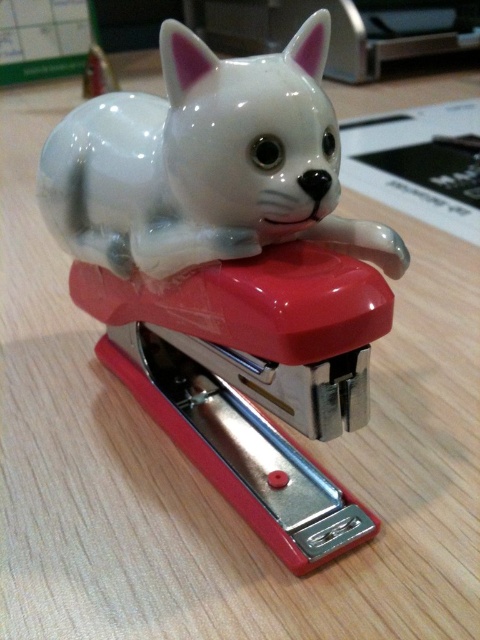
Question: Is red glossy stapler at center above white glossy cat at center?

Choices:
 (A) no
 (B) yes

Answer: (A)

Question: Which object is farther from the camera taking this photo?

Choices:
 (A) white glossy cat at center
 (B) red glossy stapler at center

Answer: (B)

Question: Is red glossy stapler at center behind white glossy cat at center?

Choices:
 (A) no
 (B) yes

Answer: (B)

Question: Where is red glossy stapler at center located in relation to white glossy cat at center in the image?

Choices:
 (A) below
 (B) above

Answer: (A)